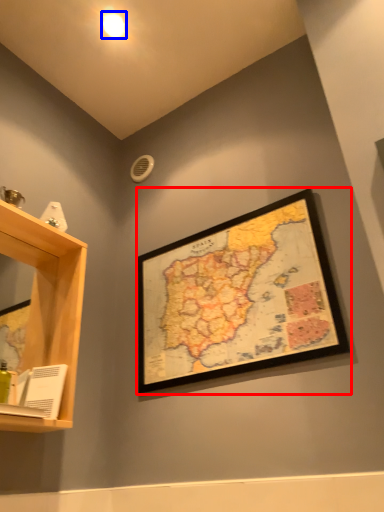
Question: Which of the following is the closest to the observer, picture frame (highlighted by a red box) or light (highlighted by a blue box)?

Choices:
 (A) picture frame
 (B) light

Answer: (A)